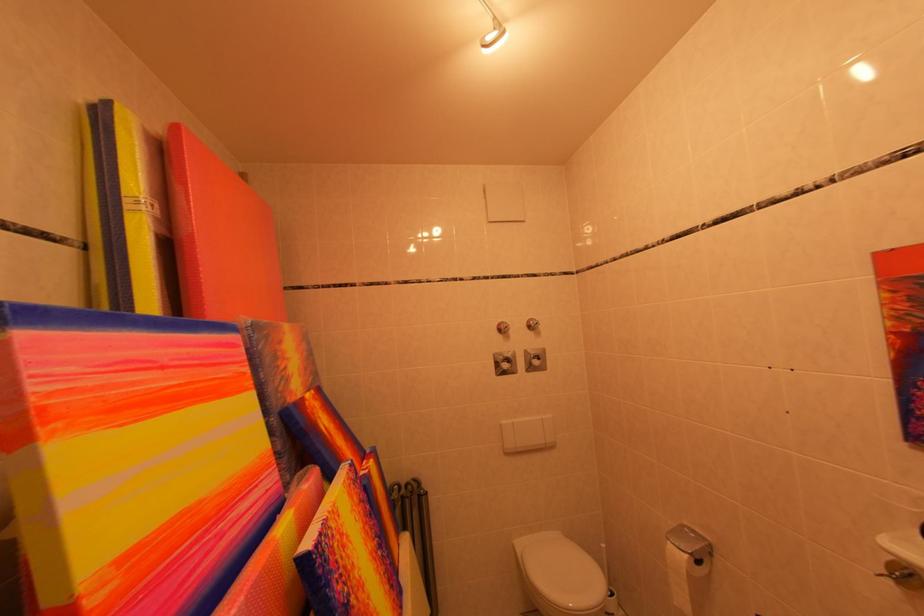
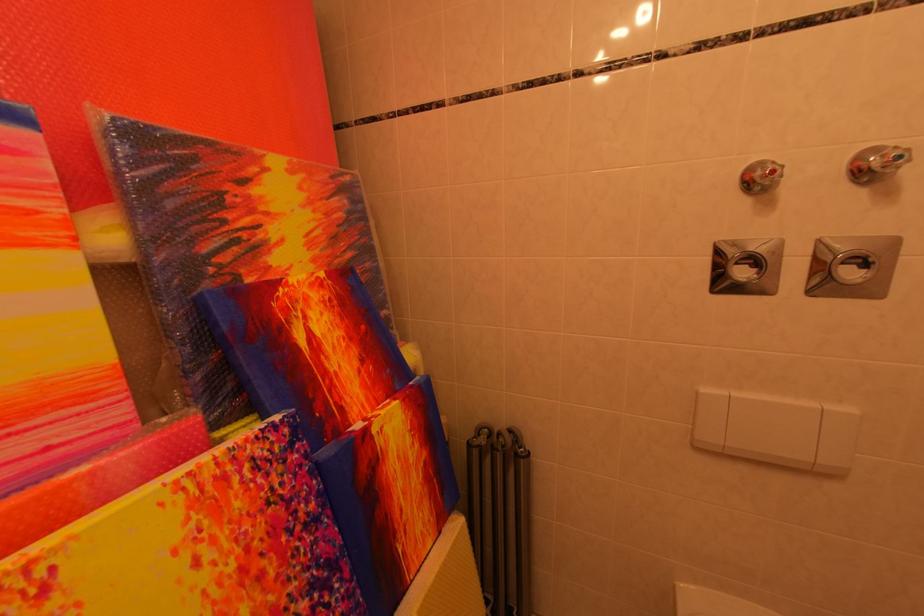
In the second image, find the point that corresponds to point (545, 328) in the first image.

(907, 161)